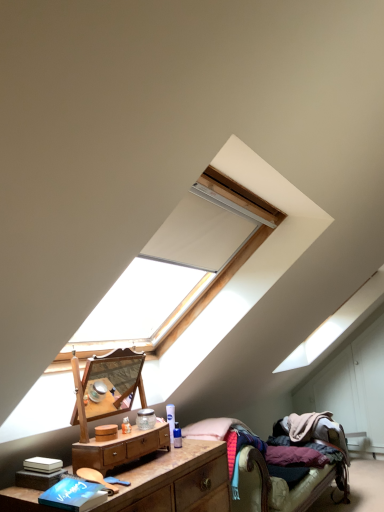
You are a GUI agent. You are given a task and a screenshot of the screen. Output one action in this format:
    pyautogui.click(x=<x>, y=<y>)
    Task: Click on the blank space situated above wooden polished nightstand at center, the 2th nightstand ordered from the bottom (from a real-world perspective)
    Image resolution: width=384 pixels, height=512 pixels.
    Given the screenshot: What is the action you would take?
    pyautogui.click(x=132, y=430)